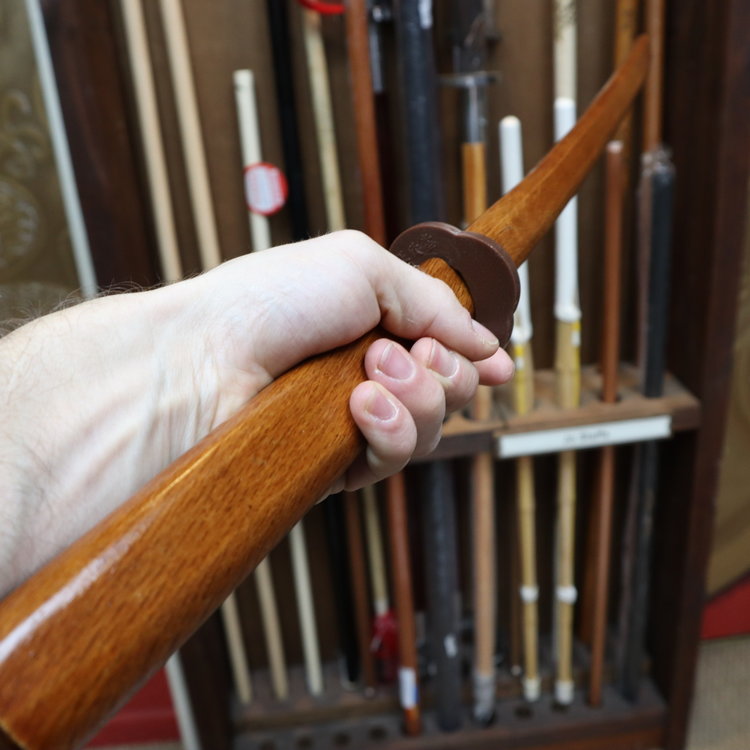
Identify the location of floor. pos(718,711).